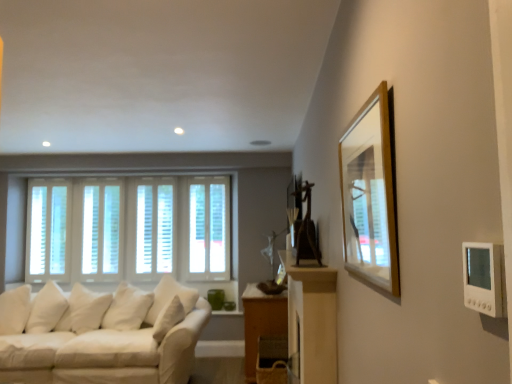
Image resolution: width=512 pixels, height=384 pixels. I want to click on empty space that is ontop of white wood blinds at center, marked as the second window in a right-to-left arrangement (from a real-world perspective), so click(x=155, y=178).